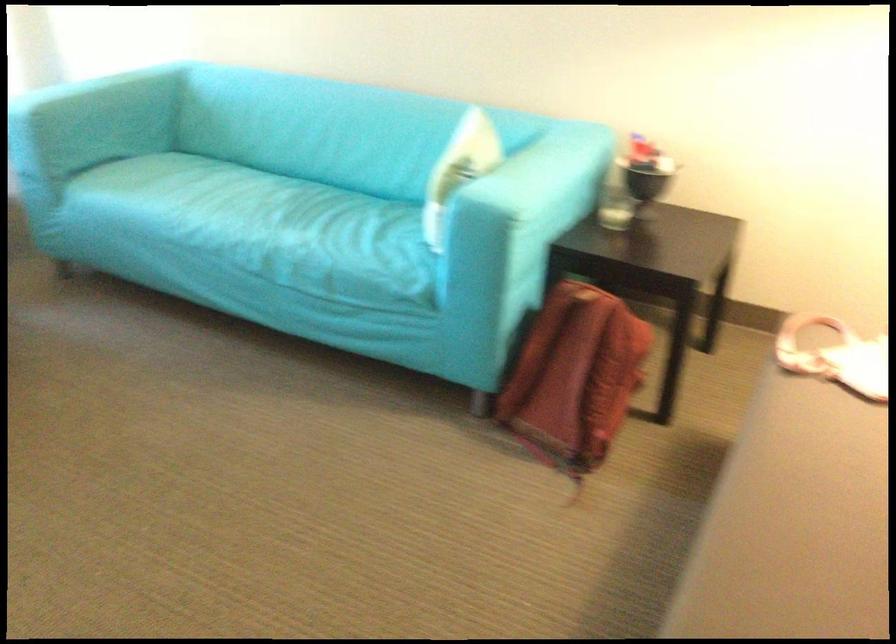
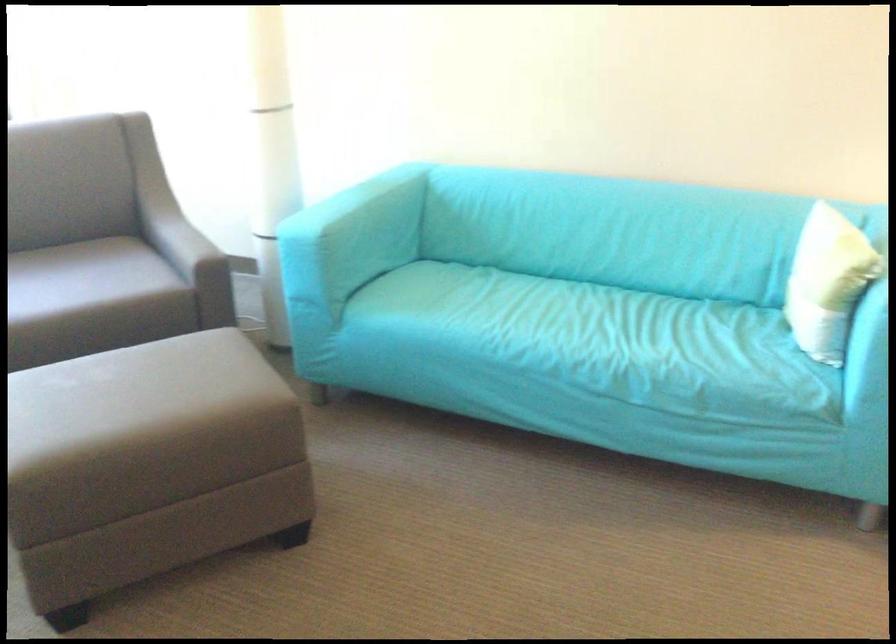
The point at (222, 212) is marked in the first image. Where is the corresponding point in the second image?

(556, 328)